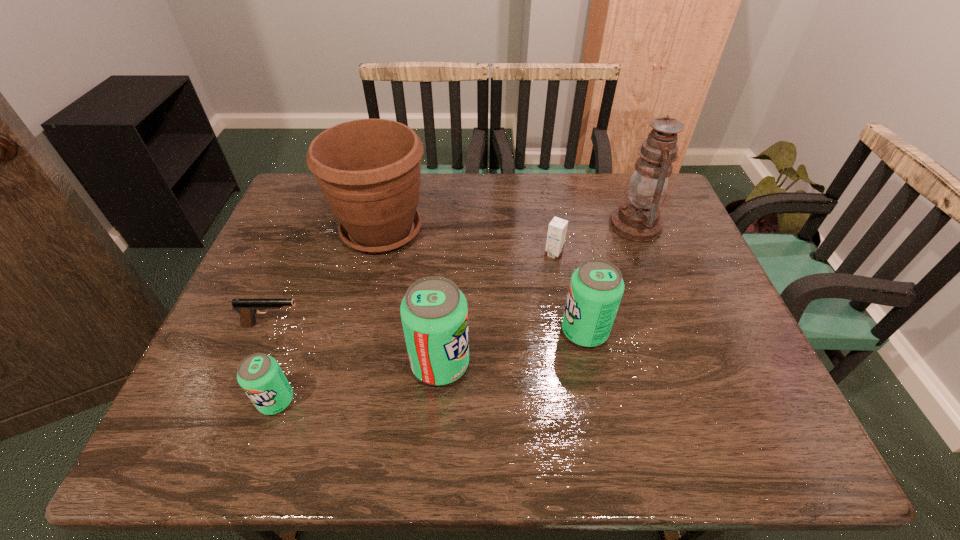
Image resolution: width=960 pixels, height=540 pixels. I want to click on the shortest pop soda, so click(260, 376).

Identify the location of the second pop soda from left to right. (434, 313).

What are the coordinates of `the rightmost pop soda` in the screenshot? It's located at (596, 287).

The image size is (960, 540). I want to click on the second shortest pop soda, so click(596, 287).

At what (x,y) coordinates should I click in order to perform the action: click on the second tallest object. Please return your answer as a coordinate pair (x, y). Image resolution: width=960 pixels, height=540 pixels. Looking at the image, I should click on (368, 170).

Where is `chocolate milk`? This screenshot has height=540, width=960. chocolate milk is located at coordinates (557, 229).

Identify the location of the tallest object. (637, 219).

The image size is (960, 540). I want to click on oil lamp, so click(x=637, y=219).

Image resolution: width=960 pixels, height=540 pixels. I want to click on the shortest object, so click(x=247, y=308).

Locate an element on the screen. The height and width of the screenshot is (540, 960). vacant point located 0.130m on the front-facing side of the second pop soda from right to left is located at coordinates (528, 363).